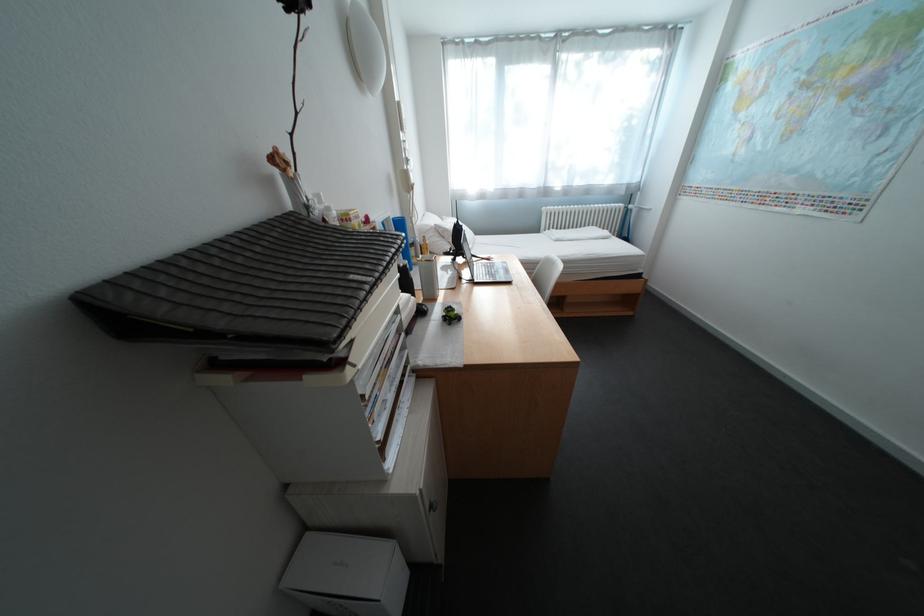
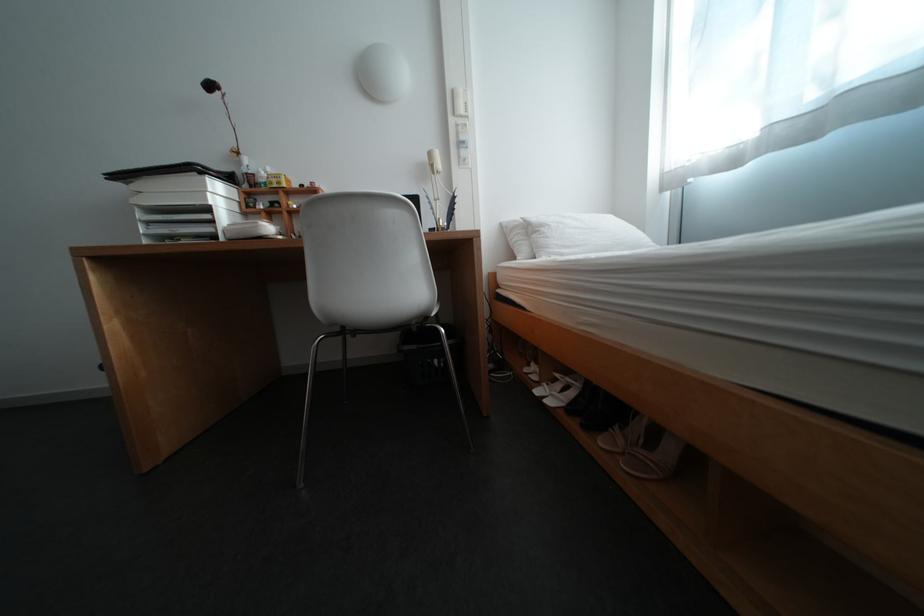
Locate, in the second image, the point that corresponds to point (411, 105) in the first image.

(466, 92)